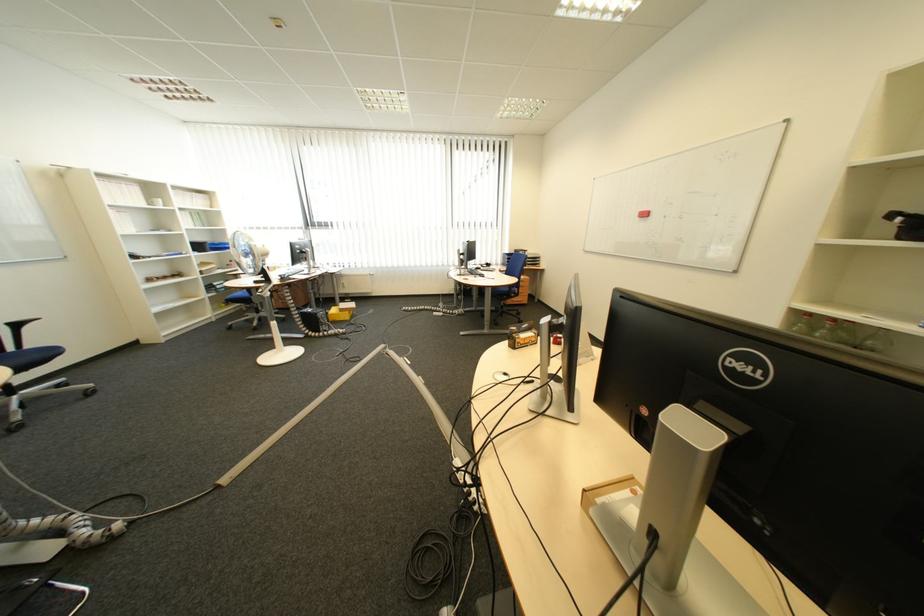
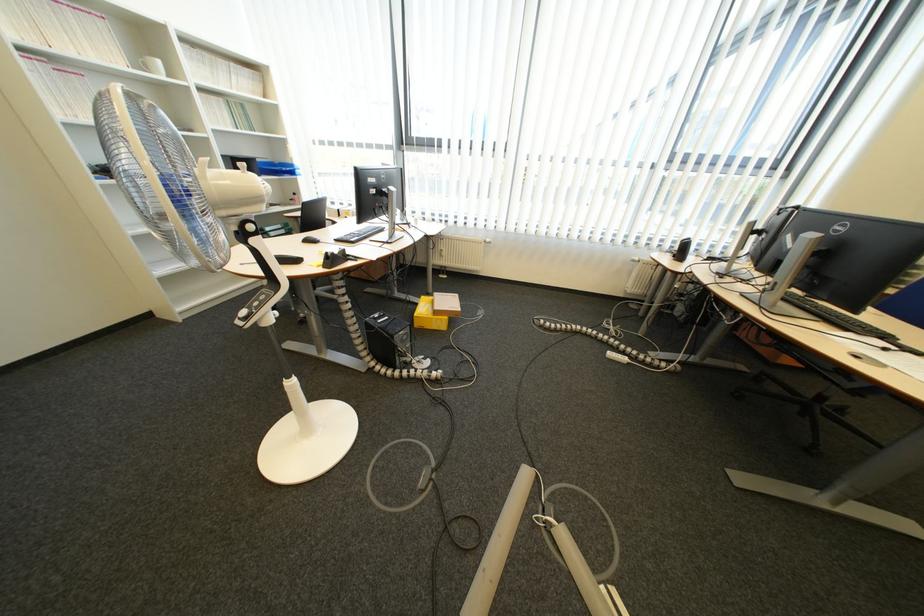
Find the pixel in the second image that matches [460,313] in the first image.

(654, 358)